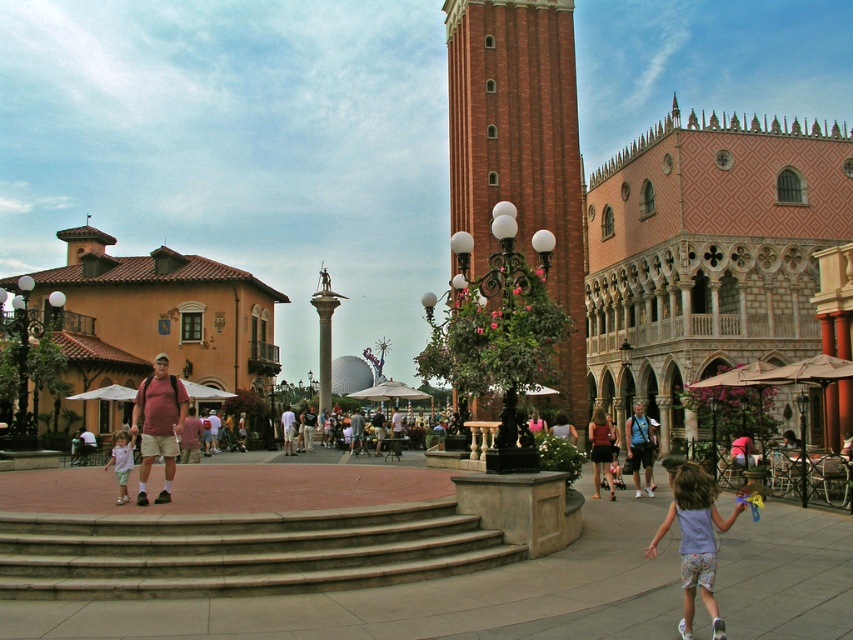
Who is higher up, brick bell tower at center or light brown leather jacket at center?

brick bell tower at center is above.

What do you see at coordinates (520, 147) in the screenshot? The image size is (853, 640). I see `brick bell tower at center` at bounding box center [520, 147].

Find the location of a particular element. The height and width of the screenshot is (640, 853). brick bell tower at center is located at coordinates (520, 147).

The image size is (853, 640). What are the coordinates of `brick bell tower at center` in the screenshot? It's located at (520, 147).

Can you confirm if brick bell tower at center is wider than matte pink dress at lower right?

Yes, brick bell tower at center is wider than matte pink dress at lower right.

Where is `brick bell tower at center`? The width and height of the screenshot is (853, 640). brick bell tower at center is located at coordinates (520, 147).

Can you confirm if matte pink shirt at center is positioned above matte pink dress at lower right?

Indeed, matte pink shirt at center is positioned over matte pink dress at lower right.

Which is more to the left, matte pink shirt at center or matte pink dress at lower right?

matte pink shirt at center

What do you see at coordinates (158, 422) in the screenshot? The image size is (853, 640). I see `matte pink shirt at center` at bounding box center [158, 422].

Find the location of `matte pink shirt at center`. matte pink shirt at center is located at coordinates (158, 422).